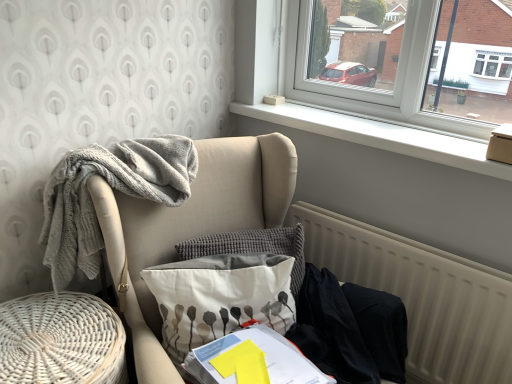
What is the approximate height of white fabric pillow with gray floral pattern at center, the 2th pillow when ordered from back to front?

The height of white fabric pillow with gray floral pattern at center, the 2th pillow when ordered from back to front, is 11.83 inches.

Locate an element on the screen. The height and width of the screenshot is (384, 512). textured beige armchair at left is located at coordinates (190, 225).

Describe the element at coordinates (381, 135) in the screenshot. I see `white smooth window sill at upper center` at that location.

Locate an element on the screen. textured gray pillow at center, which is the 2th pillow in front-to-back order is located at coordinates (252, 247).

Measure the distance between white woven basket at lower left and camera.

The depth of white woven basket at lower left is 1.03 meters.

The height and width of the screenshot is (384, 512). What do you see at coordinates (61, 340) in the screenshot?
I see `white woven basket at lower left` at bounding box center [61, 340].

Where is `white fabric pillow with gray floral pattern at center, the 2th pillow when ordered from back to front`? This screenshot has height=384, width=512. white fabric pillow with gray floral pattern at center, the 2th pillow when ordered from back to front is located at coordinates tap(220, 297).

Can you tell me how much beige textured radiator at lower right and white smooth window sill at upper center differ in facing direction?

They differ by 0.361 degrees in their facing directions.

From a real-world perspective, which is physically below, beige textured radiator at lower right or white smooth window sill at upper center?

beige textured radiator at lower right, from a real-world perspective.

Is white smooth window sill at upper center located within beige textured radiator at lower right?

No, white smooth window sill at upper center is located outside of beige textured radiator at lower right.

Is beige textured radiator at lower right looking in the opposite direction of white smooth window sill at upper center?

No, white smooth window sill at upper center is not at the back of beige textured radiator at lower right.

Considering the relative sizes of textured gray pillow at center, which is the 2th pillow in front-to-back order, and white fabric pillow with gray floral pattern at center, placed as the first pillow when sorted from front to back, in the image provided, is textured gray pillow at center, which is the 2th pillow in front-to-back order, taller than white fabric pillow with gray floral pattern at center, placed as the first pillow when sorted from front to back,?

Incorrect, the height of textured gray pillow at center, which is the 2th pillow in front-to-back order, is not larger of that of white fabric pillow with gray floral pattern at center, placed as the first pillow when sorted from front to back.

Would you say textured gray pillow at center, which is the first pillow in back-to-front order, is inside or outside white fabric pillow with gray floral pattern at center, the 2th pillow when ordered from back to front?

The correct answer is: outside.

From a real-world perspective, who is located higher, textured gray pillow at center, which is the 2th pillow in front-to-back order, or white fabric pillow with gray floral pattern at center, the 2th pillow when ordered from back to front?

In real-world perspective, textured gray pillow at center, which is the 2th pillow in front-to-back order, is above.

Which of these two, white fabric pillow with gray floral pattern at center, the 2th pillow when ordered from back to front, or black fabric at lower right, is thinner?

With smaller width is white fabric pillow with gray floral pattern at center, the 2th pillow when ordered from back to front.

Does white fabric pillow with gray floral pattern at center, the 2th pillow when ordered from back to front, have a smaller size compared to black fabric at lower right?

Correct, white fabric pillow with gray floral pattern at center, the 2th pillow when ordered from back to front, occupies less space than black fabric at lower right.

Is white fabric pillow with gray floral pattern at center, the 2th pillow when ordered from back to front, to the right of black fabric at lower right from the viewer's perspective?

No, white fabric pillow with gray floral pattern at center, the 2th pillow when ordered from back to front, is not to the right of black fabric at lower right.

From the image's perspective, relative to beige textured radiator at lower right, is textured beige armchair at left above or below?

Based on their image positions, textured beige armchair at left is located above beige textured radiator at lower right.

Would you consider textured beige armchair at left to be distant from beige textured radiator at lower right?

No, there isn't a large distance between textured beige armchair at left and beige textured radiator at lower right.

Is textured beige armchair at left taller than beige textured radiator at lower right?

Indeed, textured beige armchair at left has a greater height compared to beige textured radiator at lower right.

How many degrees apart are the facing directions of white woven basket at lower left and textured beige armchair at left?

18.4 degrees separate the facing orientations of white woven basket at lower left and textured beige armchair at left.

Is white woven basket at lower left in front of or behind textured beige armchair at left in the image?

Visually, white woven basket at lower left is located behind textured beige armchair at left.

Is white woven basket at lower left facing away from textured beige armchair at left?

white woven basket at lower left does not have its back to textured beige armchair at left.

Considering the sizes of objects white fabric pillow with gray floral pattern at center, the 2th pillow when ordered from back to front, and textured beige armchair at left in the image provided, who is taller, white fabric pillow with gray floral pattern at center, the 2th pillow when ordered from back to front, or textured beige armchair at left?

Standing taller between the two is textured beige armchair at left.

What's the angular difference between white fabric pillow with gray floral pattern at center, the 2th pillow when ordered from back to front, and textured beige armchair at left's facing directions?

The angle between the facing direction of white fabric pillow with gray floral pattern at center, the 2th pillow when ordered from back to front, and the facing direction of textured beige armchair at left is 20.6 degrees.

Considering the sizes of white fabric pillow with gray floral pattern at center, the 2th pillow when ordered from back to front, and textured beige armchair at left in the image, is white fabric pillow with gray floral pattern at center, the 2th pillow when ordered from back to front, bigger or smaller than textured beige armchair at left?

Considering their sizes, white fabric pillow with gray floral pattern at center, the 2th pillow when ordered from back to front, takes up less space than textured beige armchair at left.

From a real-world perspective, is white fabric pillow with gray floral pattern at center, the 2th pillow when ordered from back to front, positioned under textured beige armchair at left based on gravity?

Incorrect, from a real-world perspective, white fabric pillow with gray floral pattern at center, the 2th pillow when ordered from back to front, is higher than textured beige armchair at left.

Would you say beige textured radiator at lower right is inside or outside textured gray pillow at center, which is the first pillow in back-to-front order?

beige textured radiator at lower right exists outside the volume of textured gray pillow at center, which is the first pillow in back-to-front order.

Between beige textured radiator at lower right and textured gray pillow at center, which is the first pillow in back-to-front order, which one has less height?

Standing shorter between the two is textured gray pillow at center, which is the first pillow in back-to-front order.

In the image, is beige textured radiator at lower right positioned in front of or behind textured gray pillow at center, which is the 2th pillow in front-to-back order?

Visually, beige textured radiator at lower right is located in front of textured gray pillow at center, which is the 2th pillow in front-to-back order.

From the image's perspective, which one is positioned higher, beige textured radiator at lower right or textured gray pillow at center, which is the 2th pillow in front-to-back order?

textured gray pillow at center, which is the 2th pillow in front-to-back order, appears higher in the image.

You are a GUI agent. You are given a task and a screenshot of the screen. Output one action in this format:
    pyautogui.click(x=<x>, y=<y>)
    Task: Click on the window sill behind the beige textured radiator at lower right
    This screenshot has width=512, height=384.
    Given the screenshot: What is the action you would take?
    pyautogui.click(x=381, y=135)

The width and height of the screenshot is (512, 384). In the image, there is a textured gray pillow at center, which is the first pillow in back-to-front order. Find the location of `pillow below it (from a real-world perspective)`. pillow below it (from a real-world perspective) is located at coordinates (220, 297).

Considering their positions, is textured beige armchair at left positioned closer to beige textured radiator at lower right than white smooth window sill at upper center?

The object closer to beige textured radiator at lower right is white smooth window sill at upper center.

Which object lies nearer to the anchor point textured gray pillow at center, which is the first pillow in back-to-front order, white woven basket at lower left or black fabric at lower right?

The object closer to textured gray pillow at center, which is the first pillow in back-to-front order, is black fabric at lower right.

Based on their spatial positions, is white fabric pillow with gray floral pattern at center, the 2th pillow when ordered from back to front, or textured gray pillow at center, which is the 2th pillow in front-to-back order, closer to white woven basket at lower left?

Among the two, white fabric pillow with gray floral pattern at center, the 2th pillow when ordered from back to front, is located nearer to white woven basket at lower left.

Which object lies nearer to the anchor point black fabric at lower right, beige textured radiator at lower right or white smooth window sill at upper center?

beige textured radiator at lower right lies closer to black fabric at lower right than the other object.

Estimate the real-world distances between objects in this image. Which object is further from white fabric pillow with gray floral pattern at center, placed as the first pillow when sorted from front to back, textured beige armchair at left or white woven basket at lower left?

Among the two, white woven basket at lower left is located further to white fabric pillow with gray floral pattern at center, placed as the first pillow when sorted from front to back.

When comparing their distances from beige textured radiator at lower right, does white smooth window sill at upper center or textured gray pillow at center, which is the first pillow in back-to-front order, seem closer?

textured gray pillow at center, which is the first pillow in back-to-front order.

From the image, which object appears to be nearer to white smooth window sill at upper center, textured gray pillow at center, which is the 2th pillow in front-to-back order, or beige textured radiator at lower right?

beige textured radiator at lower right.

Estimate the real-world distances between objects in this image. Which object is further from white fabric pillow with gray floral pattern at center, placed as the first pillow when sorted from front to back, white woven basket at lower left or white smooth window sill at upper center?

white smooth window sill at upper center is positioned further to the anchor white fabric pillow with gray floral pattern at center, placed as the first pillow when sorted from front to back.

Locate an element on the screen. The image size is (512, 384). pillow between white woven basket at lower left and textured gray pillow at center, which is the 2th pillow in front-to-back order, from left to right is located at coordinates (220, 297).

You are a GUI agent. You are given a task and a screenshot of the screen. Output one action in this format:
    pyautogui.click(x=<x>, y=<y>)
    Task: Click on the pillow between white fabric pillow with gray floral pattern at center, placed as the first pillow when sorted from front to back, and beige textured radiator at lower right, in the horizontal direction
    This screenshot has width=512, height=384.
    Given the screenshot: What is the action you would take?
    pyautogui.click(x=252, y=247)

Locate an element on the screen. furniture between white smooth window sill at upper center and black fabric at lower right in the vertical direction is located at coordinates (190, 225).

Image resolution: width=512 pixels, height=384 pixels. Identify the location of clothing between white fabric pillow with gray floral pattern at center, placed as the first pillow when sorted from front to back, and beige textured radiator at lower right from left to right. (350, 329).